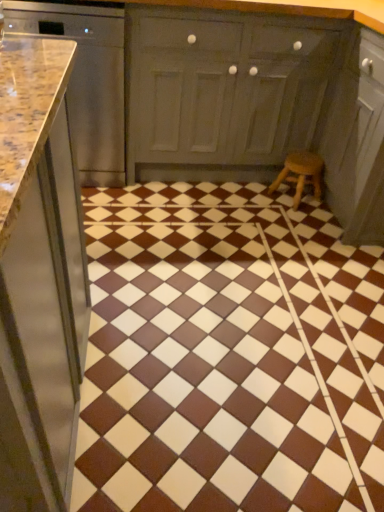
Question: Choose the correct answer: Is wooden stool at lower right inside brown glossy tile at center or outside it?

Choices:
 (A) outside
 (B) inside

Answer: (A)

Question: From a real-world perspective, is wooden stool at lower right positioned above or below brown glossy tile at center?

Choices:
 (A) above
 (B) below

Answer: (A)

Question: Which is farther from the brown glossy tile at center?

Choices:
 (A) matte gray cabinet at center, marked as the first cabinetry in a right-to-left arrangement
 (B) wooden stool at lower right
 (C) polished granite countertop at left, arranged as the 2th cabinetry when viewed from the right

Answer: (C)

Question: Based on their relative distances, which object is farther from the brown glossy tile at center?

Choices:
 (A) wooden stool at lower right
 (B) polished granite countertop at left, acting as the first cabinetry starting from the left
 (C) matte gray cabinet at center, marked as the first cabinetry in a right-to-left arrangement

Answer: (B)